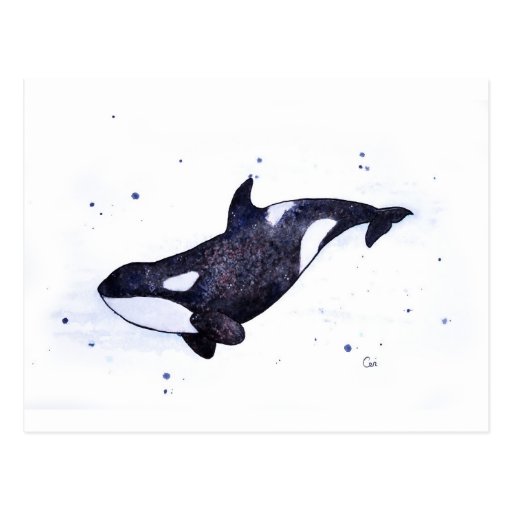
Image resolution: width=512 pixels, height=512 pixels. What are the coordinates of `canvas` in the screenshot? It's located at (465, 384).